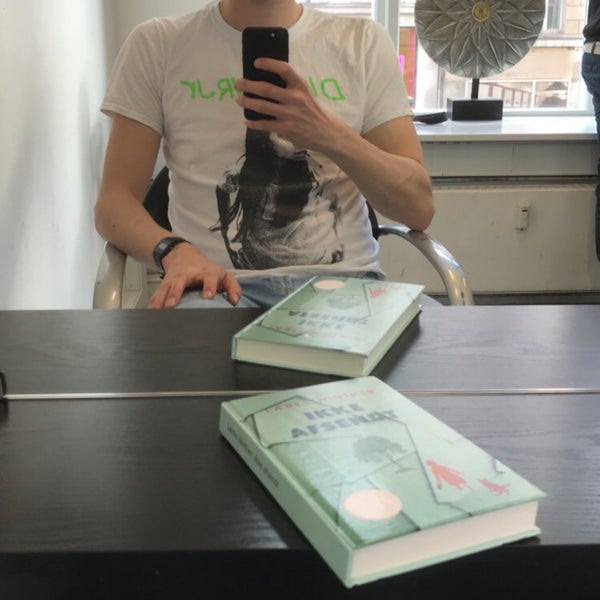
You are a GUI agent. You are given a task and a screenshot of the screen. Output one action in this format:
    pyautogui.click(x=<x>, y=<y>)
    Task: Click on the table
    This screenshot has width=600, height=600.
    Given the screenshot: What is the action you would take?
    pyautogui.click(x=128, y=472), pyautogui.click(x=530, y=327), pyautogui.click(x=195, y=345)